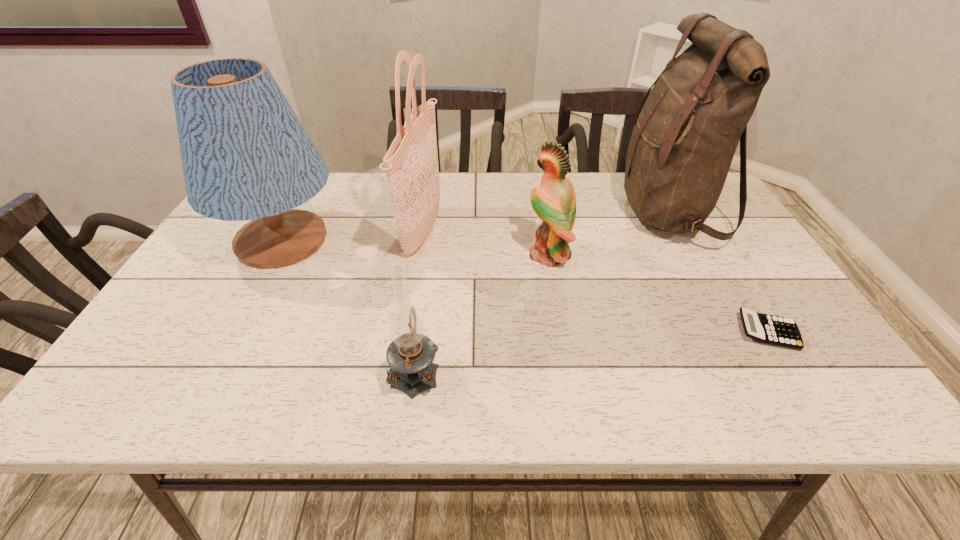
You are a GUI agent. You are given a task and a screenshot of the screen. Output one action in this format:
    pyautogui.click(x=<x>, y=<y>)
    Task: Click on the object at the left edge
    Image resolution: width=960 pixels, height=540 pixels.
    Given the screenshot: What is the action you would take?
    pyautogui.click(x=246, y=156)

In order to click on backpack present at the right edge in this screenshot , I will do `click(684, 139)`.

Identify the location of calculator at the right edge. (775, 330).

Where is `object located at the far left corner`? The width and height of the screenshot is (960, 540). object located at the far left corner is located at coordinates (246, 156).

This screenshot has width=960, height=540. What are the coordinates of `object present at the far right corner` in the screenshot? It's located at (684, 139).

Where is `vacant space at the far edge of the desktop`? This screenshot has width=960, height=540. vacant space at the far edge of the desktop is located at coordinates (624, 205).

Identify the location of vacant area at the near edge. (214, 392).

Find the location of `blank space at the left edge of the desktop`. blank space at the left edge of the desktop is located at coordinates (227, 290).

Find the location of a particular element. free space at the near left corner is located at coordinates (121, 383).

Locate an element on the screen. free space that is in between the parrot and the oil lamp is located at coordinates (482, 313).